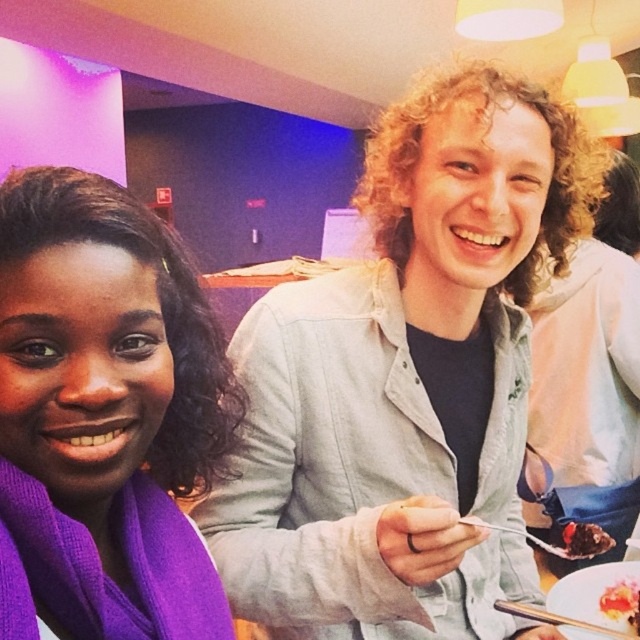
Who is positioned more to the right, purple scarf at left or chocolate cake at lower right?

Positioned to the right is chocolate cake at lower right.

Between purple scarf at left and chocolate cake at lower right, which one is positioned higher?

purple scarf at left is higher up.

Is point (77, 456) more distant than point (595, 554)?

That is False.

This screenshot has width=640, height=640. I want to click on purple scarf at left, so click(x=106, y=346).

Is white glossy plate at lower right thinner than chocolate cake at lower right?

In fact, white glossy plate at lower right might be wider than chocolate cake at lower right.

Where is `white glossy plate at lower right`? white glossy plate at lower right is located at coordinates (593, 593).

Is purple wool scarf at upper left wider than smooth chocolate cake at center?

Indeed, purple wool scarf at upper left has a greater width compared to smooth chocolate cake at center.

Can you confirm if purple wool scarf at upper left is taller than smooth chocolate cake at center?

Yes.

You are a GUI agent. You are given a task and a screenshot of the screen. Output one action in this format:
    pyautogui.click(x=<x>, y=<y>)
    Task: Click on the purple wool scarf at upper left
    
    Given the screenshot: What is the action you would take?
    pyautogui.click(x=404, y=380)

This screenshot has height=640, width=640. I want to click on purple wool scarf at upper left, so click(404, 380).